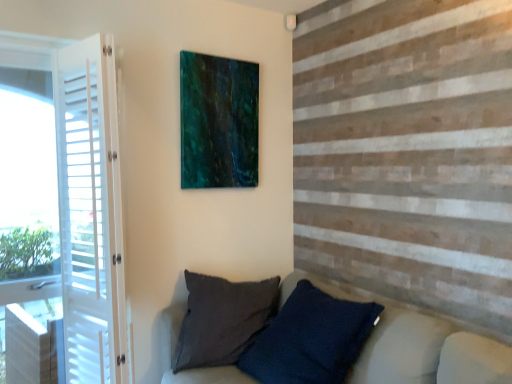
The image size is (512, 384). What are the coordinates of `teal glossy painting at upper center` in the screenshot? It's located at point(218,121).

This screenshot has height=384, width=512. In order to click on teal glossy painting at upper center in this screenshot , I will do click(x=218, y=121).

Where is `screen door above the dark blue textured pillow at lower center (from the image's perspective)`? The image size is (512, 384). screen door above the dark blue textured pillow at lower center (from the image's perspective) is located at coordinates (87, 209).

Is there a large distance between dark blue textured pillow at lower center and white wood screen door at left?

No, dark blue textured pillow at lower center is not far from white wood screen door at left.

Does dark blue textured pillow at lower center appear on the left side of white wood screen door at left?

No, dark blue textured pillow at lower center is not to the left of white wood screen door at left.

Is dark blue textured pillow at lower center not inside white wood screen door at left?

Yes, dark blue textured pillow at lower center is located beyond the bounds of white wood screen door at left.

From the picture: Which object is closer to the camera, teal glossy painting at upper center or white wood screen door at left?

white wood screen door at left is closer to the camera.

Considering the relative sizes of teal glossy painting at upper center and white wood screen door at left in the image provided, is teal glossy painting at upper center smaller than white wood screen door at left?

Yes.

Would you say teal glossy painting at upper center is outside white wood screen door at left?

Yes, teal glossy painting at upper center is located beyond the bounds of white wood screen door at left.

Who is shorter, teal glossy painting at upper center or white wood screen door at left?

teal glossy painting at upper center.

From the picture: From their relative heights in the image, would you say teal glossy painting at upper center is taller or shorter than dark blue textured pillow at lower center?

In the image, teal glossy painting at upper center appears to be taller than dark blue textured pillow at lower center.

From the image's perspective, which one is positioned lower, teal glossy painting at upper center or dark blue textured pillow at lower center?

dark blue textured pillow at lower center is shown below in the image.

Does teal glossy painting at upper center have a lesser width compared to dark blue textured pillow at lower center?

Indeed, teal glossy painting at upper center has a lesser width compared to dark blue textured pillow at lower center.

Could you measure the distance between teal glossy painting at upper center and dark blue textured pillow at lower center?

The distance of teal glossy painting at upper center from dark blue textured pillow at lower center is 3.41 feet.

From the image's perspective, which one is positioned lower, white wood screen door at left or teal glossy painting at upper center?

From the image's view, white wood screen door at left is below.

Does point (82, 221) come in front of point (182, 70)?

Yes, it is.

From a real-world perspective, who is located lower, white wood screen door at left or teal glossy painting at upper center?

white wood screen door at left is physically lower.

Which is more to the left, white wood screen door at left or dark blue textured pillow at lower center?

Positioned to the left is white wood screen door at left.

Does white wood screen door at left have a greater height compared to dark blue textured pillow at lower center?

Correct, white wood screen door at left is much taller as dark blue textured pillow at lower center.

Which of these two, white wood screen door at left or dark blue textured pillow at lower center, is smaller?

Smaller between the two is white wood screen door at left.

From a real-world perspective, is white wood screen door at left physically located above or below dark blue textured pillow at lower center?

white wood screen door at left is above dark blue textured pillow at lower center.

Which is behind, point (285, 319) or point (228, 139)?

The point (228, 139) is farther.

Does dark blue textured pillow at lower center have a greater width compared to teal glossy painting at upper center?

Yes, dark blue textured pillow at lower center is wider than teal glossy painting at upper center.

Considering the relative sizes of dark blue textured pillow at lower center and teal glossy painting at upper center in the image provided, is dark blue textured pillow at lower center shorter than teal glossy painting at upper center?

Indeed, dark blue textured pillow at lower center has a lesser height compared to teal glossy painting at upper center.

Considering the relative sizes of dark blue textured pillow at lower center and teal glossy painting at upper center in the image provided, is dark blue textured pillow at lower center bigger than teal glossy painting at upper center?

Correct, dark blue textured pillow at lower center is larger in size than teal glossy painting at upper center.

At what (x,y) coordinates should I click in order to perform the action: click on pillow in front of the white wood screen door at left. Please return your answer as a coordinate pair (x, y). Looking at the image, I should click on (310, 339).

The width and height of the screenshot is (512, 384). I want to click on picture frame above the white wood screen door at left (from the image's perspective), so click(x=218, y=121).

Considering their positions, is white wood screen door at left positioned closer to teal glossy painting at upper center than dark blue textured pillow at lower center?

Based on the image, white wood screen door at left appears to be nearer to teal glossy painting at upper center.

Looking at the image, which one is located closer to teal glossy painting at upper center, dark blue textured pillow at lower center or white wood screen door at left?

white wood screen door at left.

Which object lies nearer to the anchor point white wood screen door at left, dark blue textured pillow at lower center or teal glossy painting at upper center?

teal glossy painting at upper center.

Based on the photo, looking at the image, which one is located further to dark blue textured pillow at lower center, white wood screen door at left or teal glossy painting at upper center?

teal glossy painting at upper center is further to dark blue textured pillow at lower center.

Based on their spatial positions, is teal glossy painting at upper center or dark blue textured pillow at lower center further from white wood screen door at left?

dark blue textured pillow at lower center.

From the image, which object appears to be nearer to dark blue textured pillow at lower center, teal glossy painting at upper center or white wood screen door at left?

Based on the image, white wood screen door at left appears to be nearer to dark blue textured pillow at lower center.

You are a GUI agent. You are given a task and a screenshot of the screen. Output one action in this format:
    pyautogui.click(x=<x>, y=<y>)
    Task: Click on the screen door between teal glossy painting at upper center and dark blue textured pillow at lower center from top to bottom
    The width and height of the screenshot is (512, 384).
    Given the screenshot: What is the action you would take?
    pyautogui.click(x=87, y=209)